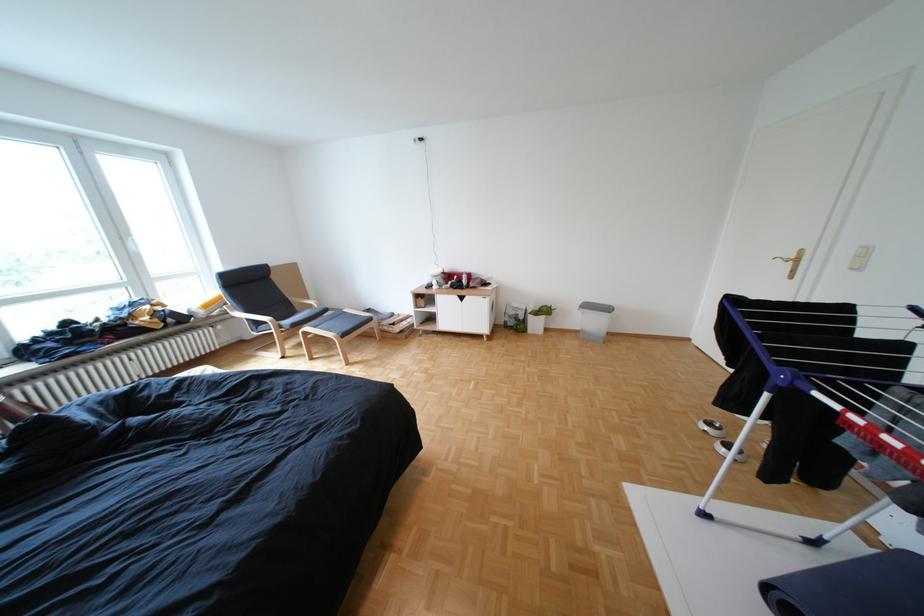
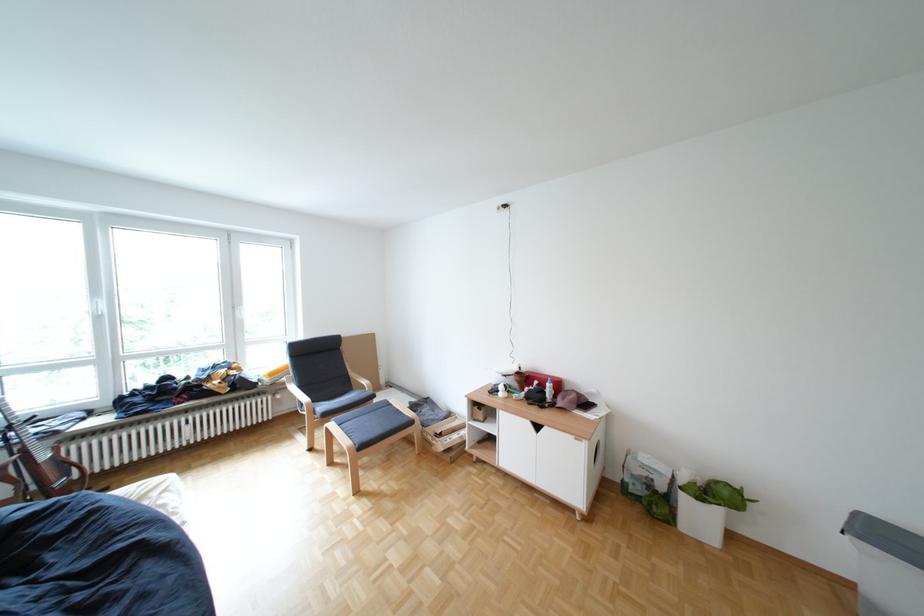
Find the pixel in the second image that matches (470,277) in the first image.

(552, 383)